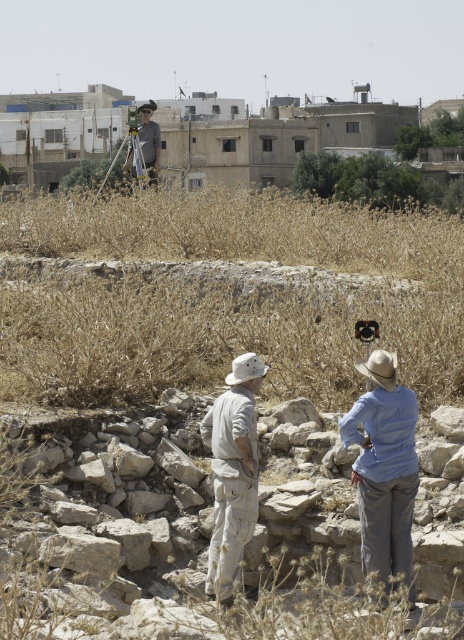
Which is behind, point (142, 458) or point (386, 468)?

Point (142, 458)

Which is more to the left, rusty stone rubble at center or blue cotton shirt at lower right?

rusty stone rubble at center is more to the left.

Who is more distant from viewer, (x=317, y=579) or (x=380, y=349)?

The point (x=317, y=579) is behind.

Image resolution: width=464 pixels, height=640 pixels. I want to click on rusty stone rubble at center, so click(x=208, y=545).

From the picture: Is matte black tripod at upper center wider than metallic tripod at upper center?

No.

Consider the image. Is matte black tripod at upper center thinner than metallic tripod at upper center?

Indeed, matte black tripod at upper center has a lesser width compared to metallic tripod at upper center.

From the picture: Who is more distant from viewer, (155, 129) or (113, 164)?

Point (113, 164)

At what (x,y) coordinates should I click in order to perform the action: click on matte black tripod at upper center. Please return your answer as a coordinate pair (x, y). Looking at the image, I should click on (148, 138).

The height and width of the screenshot is (640, 464). What do you see at coordinates (385, 468) in the screenshot?
I see `blue cotton shirt at lower right` at bounding box center [385, 468].

Which of these two, blue cotton shirt at lower right or metallic tripod at upper center, stands shorter?

blue cotton shirt at lower right is shorter.

The width and height of the screenshot is (464, 640). What do you see at coordinates (385, 468) in the screenshot?
I see `blue cotton shirt at lower right` at bounding box center [385, 468].

Image resolution: width=464 pixels, height=640 pixels. I want to click on blue cotton shirt at lower right, so click(x=385, y=468).